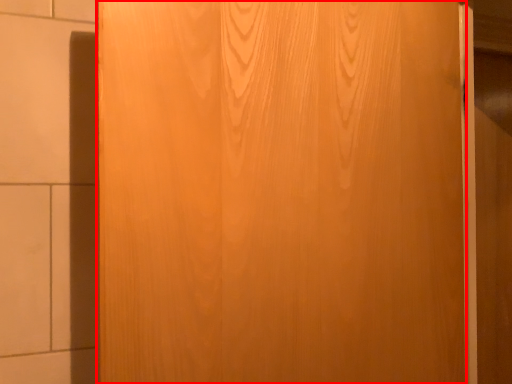
Question: Considering the relative positions of door (annotated by the red box) and barn door in the image provided, where is door (annotated by the red box) located with respect to the staircase?

Choices:
 (A) left
 (B) right

Answer: (A)